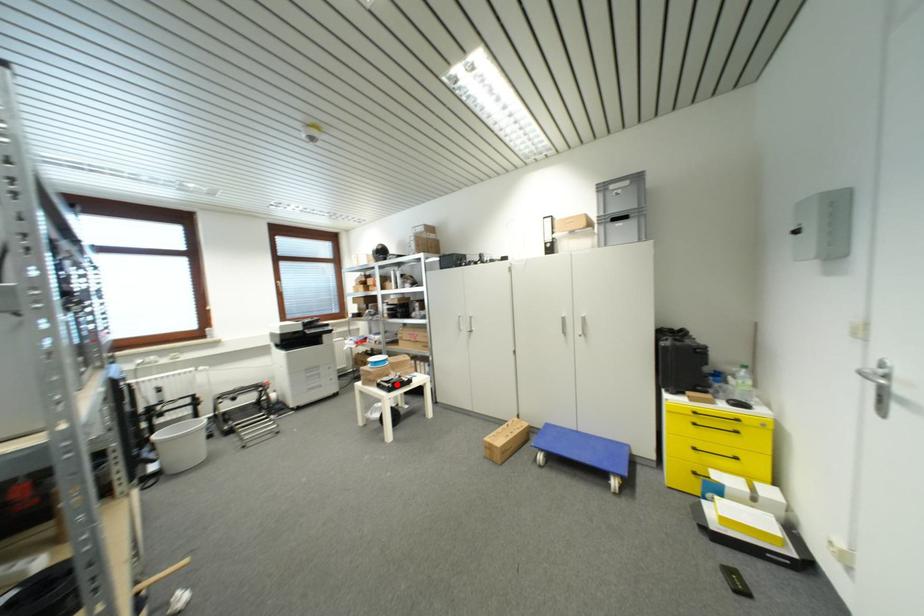
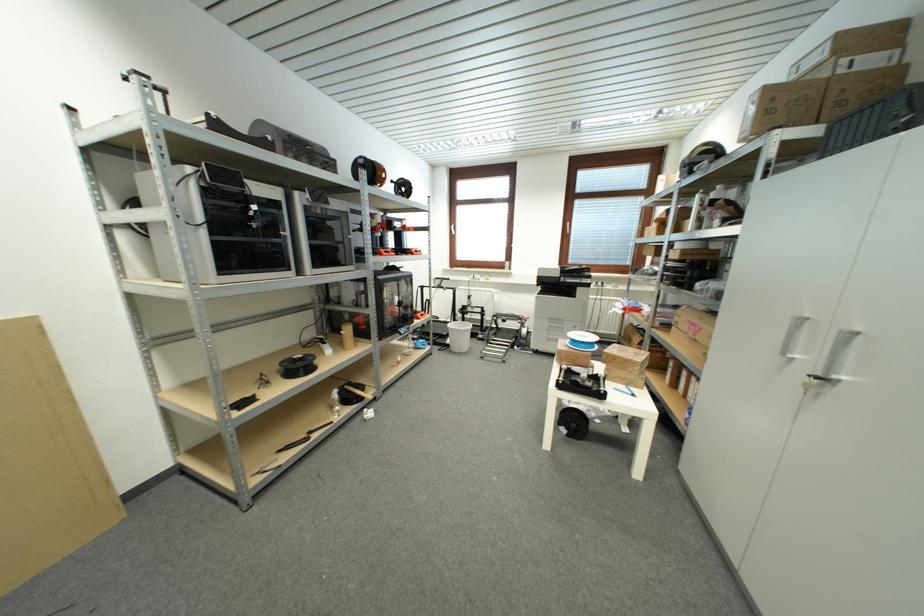
In the second image, find the point that corresponds to the highlighted location in the first image.

(578, 381)